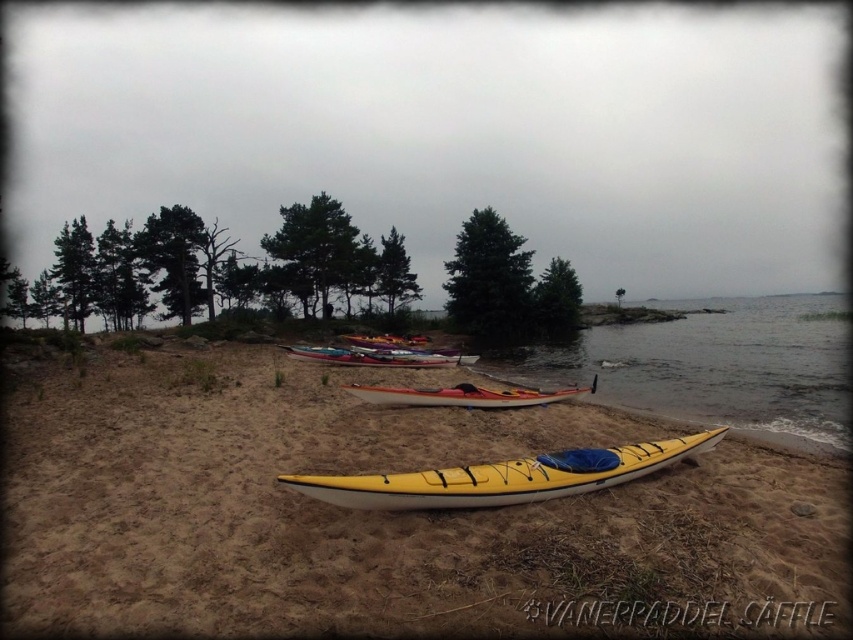
Question: Among these points, which one is farthest from the camera?

Choices:
 (A) pyautogui.click(x=560, y=365)
 (B) pyautogui.click(x=625, y=468)
 (C) pyautogui.click(x=688, y=616)
 (D) pyautogui.click(x=515, y=394)

Answer: (A)

Question: Considering the relative positions of yellow plastic kayak at lower center and matte red kayak at center in the image provided, where is yellow plastic kayak at lower center located with respect to matte red kayak at center?

Choices:
 (A) below
 (B) above

Answer: (B)

Question: Can you confirm if sandy beach at lower center is bigger than orange matte kayak at center?

Choices:
 (A) yes
 (B) no

Answer: (A)

Question: Which of these objects is positioned farthest from the sandy beach at lower center?

Choices:
 (A) yellow plastic kayak at lower center
 (B) orange matte kayak at center
 (C) yellow matte kayak at center
 (D) matte red kayak at center

Answer: (A)

Question: Among these points, which one is nearest to the camera?

Choices:
 (A) (364, 502)
 (B) (335, 605)
 (C) (544, 392)

Answer: (B)

Question: Is sandy beach at lower center further to camera compared to yellow matte kayak at center?

Choices:
 (A) yes
 (B) no

Answer: (B)